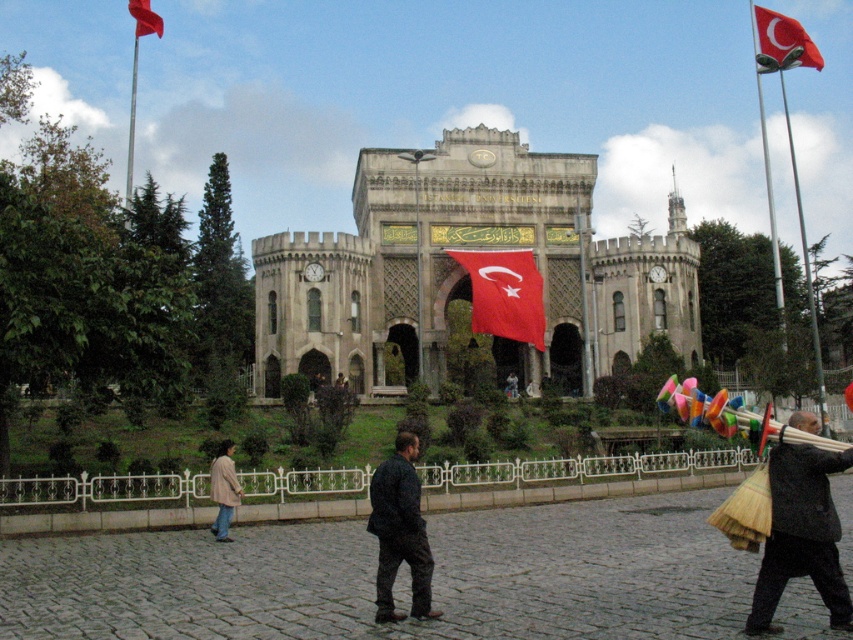
Question: Estimate the real-world distances between objects in this image. Which object is farther from the dark gray wool coat at lower right?

Choices:
 (A) dark gray fabric jacket at center
 (B) stone archway at center
 (C) red fabric flag at center
 (D) red fabric flag at upper left

Answer: (D)

Question: Can you confirm if dark gray wool coat at lower right is positioned to the left of light beige coat at lower left?

Choices:
 (A) yes
 (B) no

Answer: (B)

Question: Is red fabric flag at center positioned in front of light beige coat at lower left?

Choices:
 (A) no
 (B) yes

Answer: (A)

Question: Does stone archway at center appear on the left side of dark gray fabric jacket at center?

Choices:
 (A) yes
 (B) no

Answer: (B)

Question: Which point is farther to the camera?

Choices:
 (A) pyautogui.click(x=421, y=586)
 (B) pyautogui.click(x=519, y=310)
 (C) pyautogui.click(x=225, y=520)

Answer: (B)

Question: Which object is positioned closest to the red fabric flag at upper left?

Choices:
 (A) light beige coat at lower left
 (B) red fabric flag at center

Answer: (B)